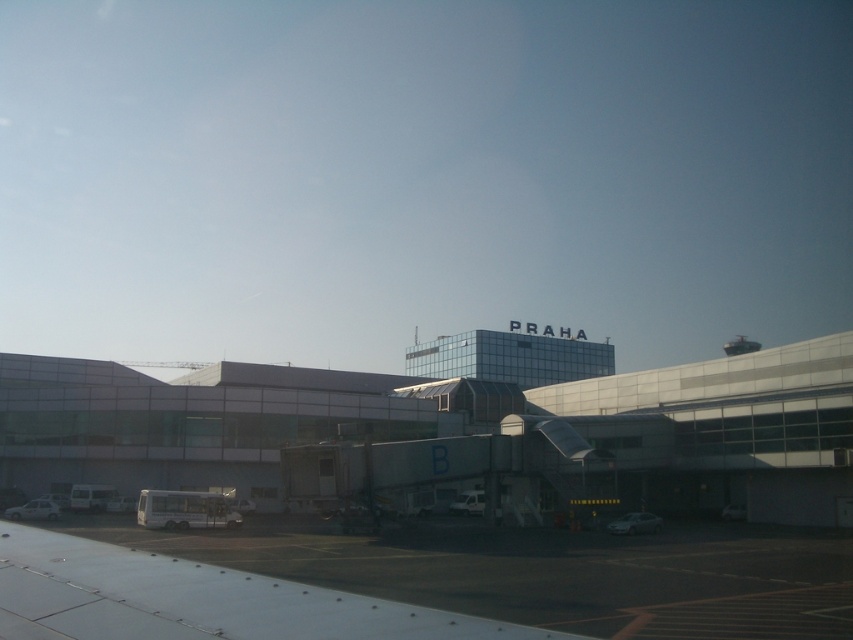
Consider the image. You are a pilot who just landed your plane at the airport. You need to determine if the glassy metallic airport terminal at center is taller than the white metallic wing at lower left. Based on the scene, can you confirm this?

The glassy metallic airport terminal at center is much taller than the white metallic wing at lower left according to the description.

You are standing at the entrance of the airport and want to take a photo of the glassy metallic airport terminal at center. Where should you position yourself to capture it in the frame?

The glassy metallic airport terminal at center is located at point (450, 433), so you should position yourself directly in front of the terminal to capture it in the frame.

You are standing in front of the airport and want to take a photo that includes both the glassy metallic airport terminal at center and the white metallic wing at lower left. Which object should you position closer to the bottom of your camera frame?

The white metallic wing at lower left should be positioned closer to the bottom of your camera frame because the glassy metallic airport terminal at center is above it.